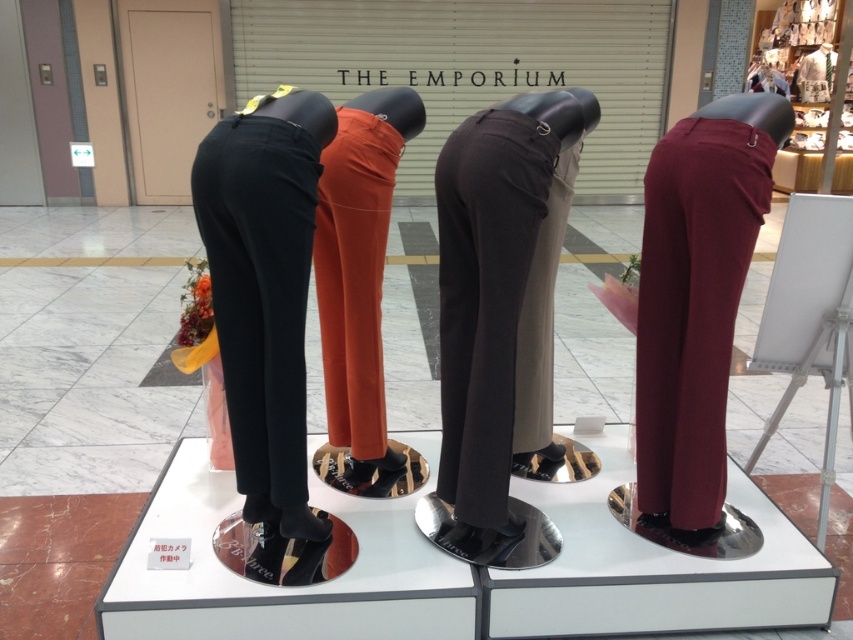
You are a store employee who needs to locate the matte black trousers at left for a customer. According to the store layout, where exactly would you find them?

The matte black trousers at left are located at point (260, 292).

You are a store employee who needs to place a new sign between the dark gray trousers at center and the orange cotton pants at center. The sign is 15 inches wide. Will it fit without overlapping either garment?

The distance between the dark gray trousers at center and orange cotton pants at center is 14.96 inches. Since the sign is 15 inches wide, it will not fit without overlapping one of the garments.

You are a customer in the store and want to take a closer look at the matte black trousers at left and the orange cotton pants at center. Which pair of trousers is nearer to you?

The matte black trousers at left is closer to the viewer than the orange cotton pants at center.